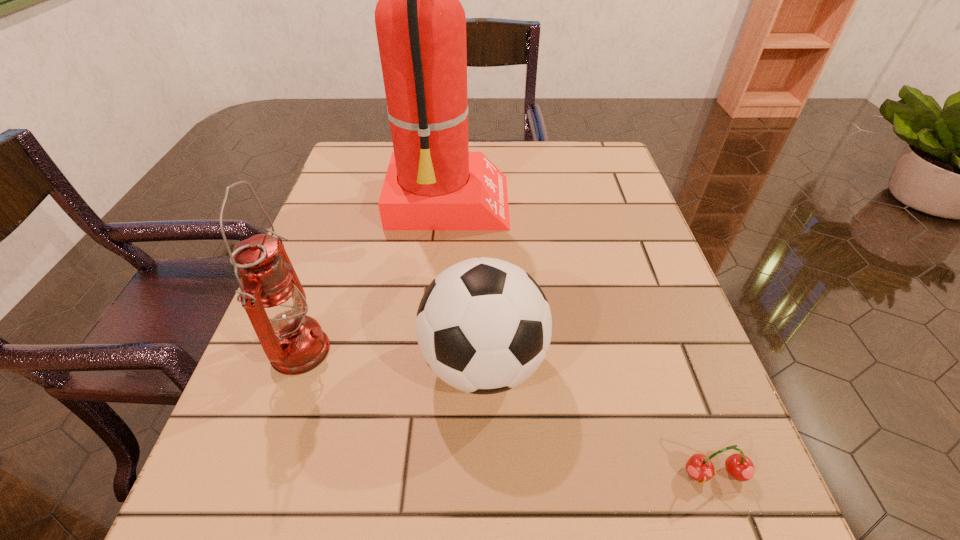
The image size is (960, 540). What are the coordinates of `vacant area located with stems pointing upwards on the cherry` in the screenshot? It's located at (735, 530).

Find the location of `object that is positioned at the far edge`. object that is positioned at the far edge is located at coordinates (433, 182).

Identify the location of fire extinguisher that is at the left edge. (433, 182).

You are a GUI agent. You are given a task and a screenshot of the screen. Output one action in this format:
    pyautogui.click(x=<x>, y=<y>)
    Task: Click on the oil lamp that is at the left edge
    
    Given the screenshot: What is the action you would take?
    pyautogui.click(x=271, y=293)

What are the coordinates of `object at the right edge` in the screenshot? It's located at (699, 467).

Where is `object situated at the far left corner`? The height and width of the screenshot is (540, 960). object situated at the far left corner is located at coordinates (433, 182).

At what (x,y) coordinates should I click in order to perform the action: click on free space at the far edge of the desktop. Please return your answer as a coordinate pair (x, y). Looking at the image, I should click on (519, 147).

The width and height of the screenshot is (960, 540). In order to click on vacant space at the near edge of the desktop in this screenshot , I will do `click(399, 498)`.

Locate an element on the screen. free space at the left edge of the desktop is located at coordinates (334, 205).

In the image, there is a desktop. At what (x,y) coordinates should I click in order to perform the action: click on free region at the right edge. Please return your answer as a coordinate pair (x, y). This screenshot has height=540, width=960. Looking at the image, I should click on (642, 260).